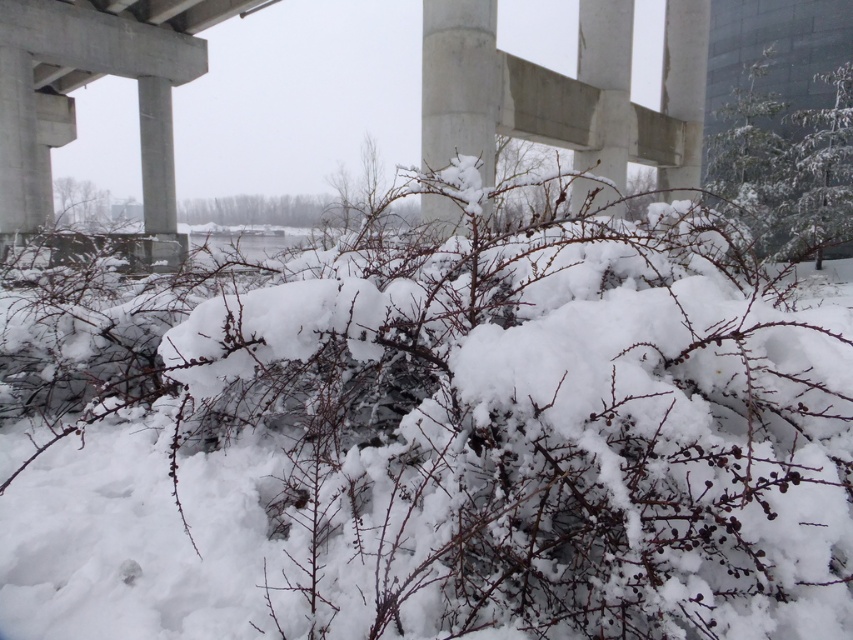
Question: Which of these objects is positioned farthest from the white fluffy snow at center?

Choices:
 (A) snow-covered concrete pillar at center
 (B) concrete at center

Answer: (B)

Question: Considering the relative positions of concrete at center and snow-covered concrete pillar at center in the image provided, where is concrete at center located with respect to snow-covered concrete pillar at center?

Choices:
 (A) left
 (B) right

Answer: (A)

Question: Can you confirm if white fluffy snow at center is wider than concrete at center?

Choices:
 (A) yes
 (B) no

Answer: (B)

Question: Is white fluffy snow at center below snow-covered concrete pillar at center?

Choices:
 (A) yes
 (B) no

Answer: (A)

Question: Estimate the real-world distances between objects in this image. Which object is farther from the snow-covered concrete pillar at center?

Choices:
 (A) white fluffy snow at center
 (B) concrete at center

Answer: (B)

Question: Estimate the real-world distances between objects in this image. Which object is farther from the snow-covered concrete pillar at center?

Choices:
 (A) white fluffy snow at center
 (B) concrete at center

Answer: (B)